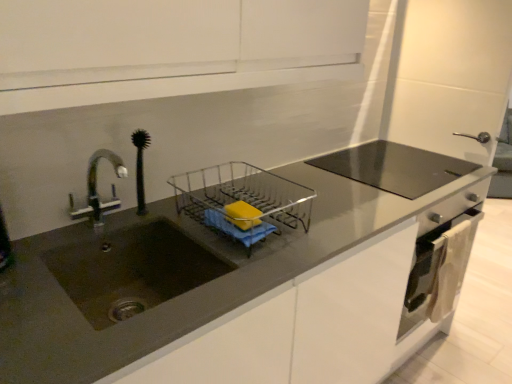
Question: From their relative heights in the image, would you say satin silver oven at lower right is taller or shorter than matte dark brown sink at left?

Choices:
 (A) tall
 (B) short

Answer: (A)

Question: Relative to matte dark brown sink at left, is satin silver oven at lower right in front or behind?

Choices:
 (A) behind
 (B) front

Answer: (A)

Question: Considering the real-world distances, which object is farthest from the matte dark brown sink at left?

Choices:
 (A) matte gray countertop at center
 (B) clear plastic dish rack at center
 (C) yellow matte soap at center
 (D) satin silver oven at lower right

Answer: (D)

Question: Which of these objects is positioned closest to the satin silver oven at lower right?

Choices:
 (A) matte gray countertop at center
 (B) matte dark brown sink at left
 (C) yellow matte soap at center
 (D) clear plastic dish rack at center

Answer: (A)